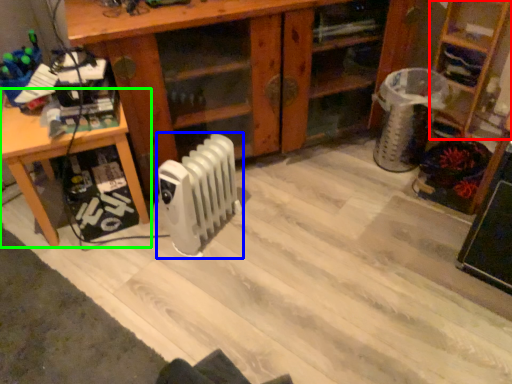
Question: Which object is the closest to the shelf (highlighted by a red box)? Choose among these: radiator (highlighted by a blue box) or table (highlighted by a green box).

Choices:
 (A) radiator
 (B) table

Answer: (A)